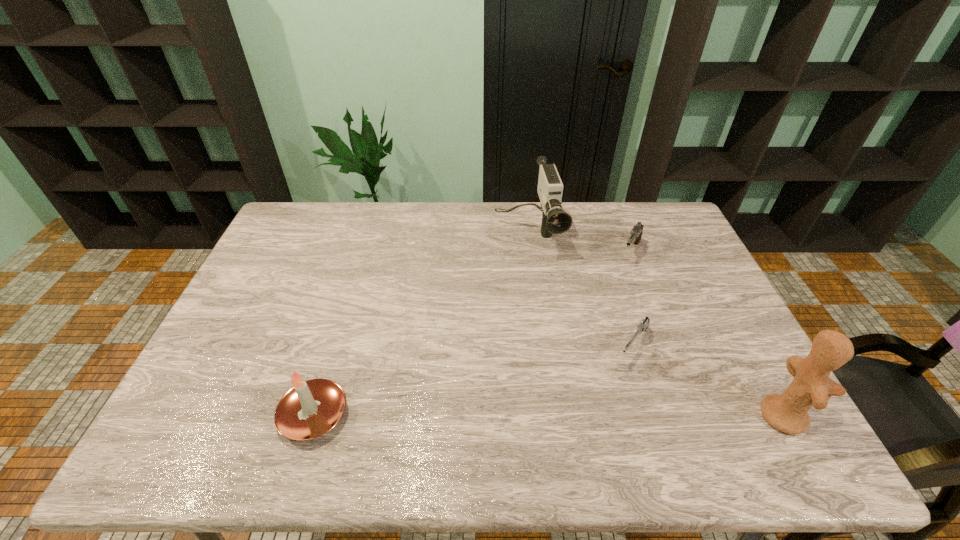
Where is `candle`? candle is located at coordinates (311, 408).

Find the location of `the leftmost object`. the leftmost object is located at coordinates (311, 408).

Locate an element on the screen. the rightmost object is located at coordinates (811, 386).

Where is `the tallest object`? The height and width of the screenshot is (540, 960). the tallest object is located at coordinates (811, 386).

At what (x,y) coordinates should I click in order to perform the action: click on the third farthest object. Please return your answer as a coordinate pair (x, y). The width and height of the screenshot is (960, 540). Looking at the image, I should click on (643, 325).

At what (x,y) coordinates should I click in order to perform the action: click on the shorter pistol. Please return your answer as a coordinate pair (x, y). Image resolution: width=960 pixels, height=540 pixels. Looking at the image, I should click on (643, 325).

The image size is (960, 540). In order to click on the fourth object from right to left in this screenshot , I will do `click(555, 220)`.

The width and height of the screenshot is (960, 540). I want to click on camcorder, so click(555, 220).

Find the location of `the farther pistol`. the farther pistol is located at coordinates (636, 233).

This screenshot has width=960, height=540. Find the location of `the fourth tallest object`. the fourth tallest object is located at coordinates (636, 233).